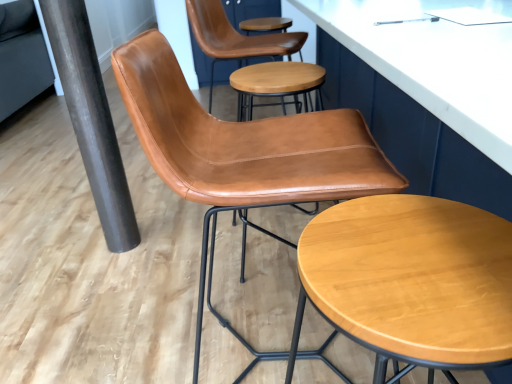
Question: Choose the correct answer: Is light brown wood stool at center inside black metallic pole at lower left or outside it?

Choices:
 (A) outside
 (B) inside

Answer: (A)

Question: Would you say light brown wood stool at center is to the left or to the right of black metallic pole at lower left in the picture?

Choices:
 (A) left
 (B) right

Answer: (B)

Question: Estimate the real-world distances between objects in this image. Which object is farther from the cognac leather chair at center?

Choices:
 (A) light brown wood stool at center
 (B) black metallic pole at lower left

Answer: (B)

Question: Which of these objects is positioned farthest from the cognac leather chair at center?

Choices:
 (A) light brown wood stool at center
 (B) black metallic pole at lower left

Answer: (B)